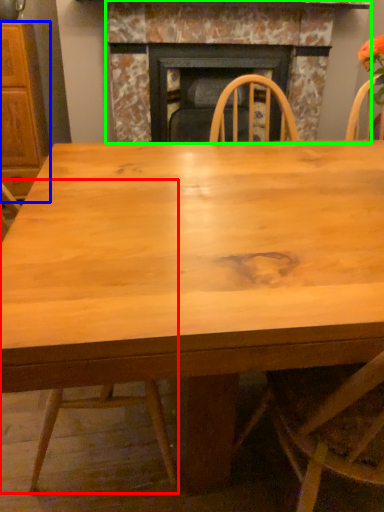
Question: Considering the real-world distances, which object is farthest from chair (highlighted by a red box)? cabinetry (highlighted by a blue box) or fireplace (highlighted by a green box)?

Choices:
 (A) cabinetry
 (B) fireplace

Answer: (B)